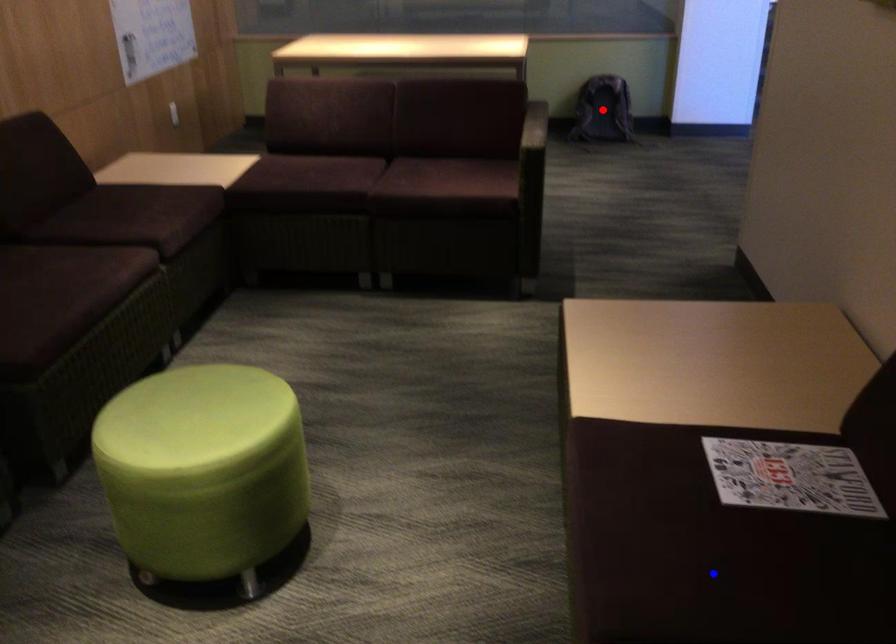
Question: In the image, two points are highlighted. Which point is nearer to the camera? Reply with the corresponding letter.

Choices:
 (A) blue point
 (B) red point

Answer: (A)